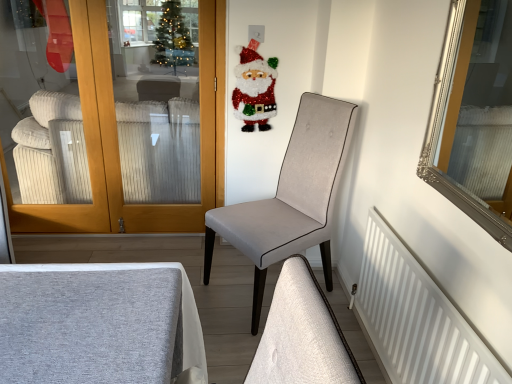
Question: Which is correct: white matte radiator at lower right is inside glittery santa claus at upper center, or outside of it?

Choices:
 (A) inside
 (B) outside

Answer: (B)

Question: In terms of height, does white matte radiator at lower right look taller or shorter compared to glittery santa claus at upper center?

Choices:
 (A) tall
 (B) short

Answer: (A)

Question: Which of these objects is positioned farthest from the silver/glass mirror at upper right?

Choices:
 (A) glittery santa claus at upper center
 (B) white matte radiator at lower right
 (C) white ribbed fabric couch at left
 (D) light gray fabric chair at center

Answer: (C)

Question: Which object is the closest to the white matte radiator at lower right?

Choices:
 (A) silver/glass mirror at upper right
 (B) light gray fabric chair at center
 (C) glittery santa claus at upper center
 (D) white ribbed fabric couch at left

Answer: (B)